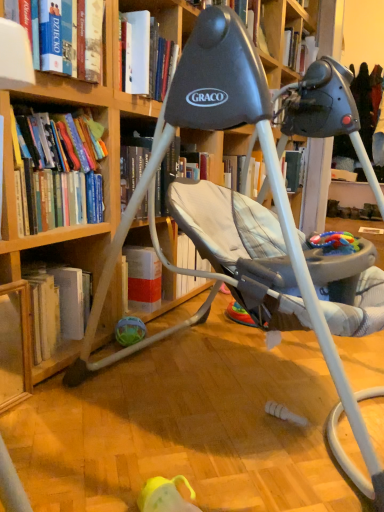
At what (x,y) coordinates should I click in order to perform the action: click on free space in front of translucent plastic ball at lower center, which ranks as the second toy in right-to-left order. Please return your answer as a coordinate pair (x, y). The width and height of the screenshot is (384, 512). Looking at the image, I should click on [x=133, y=367].